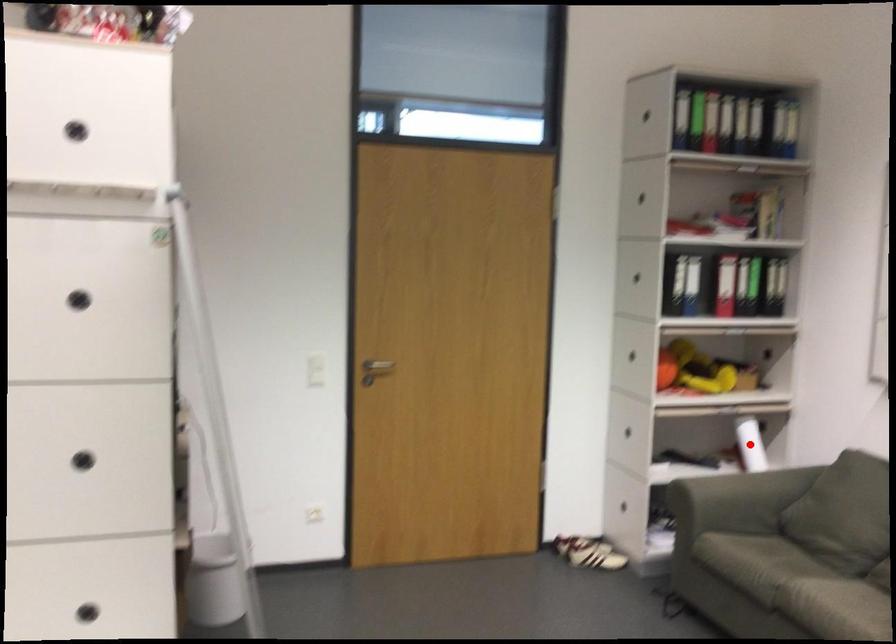
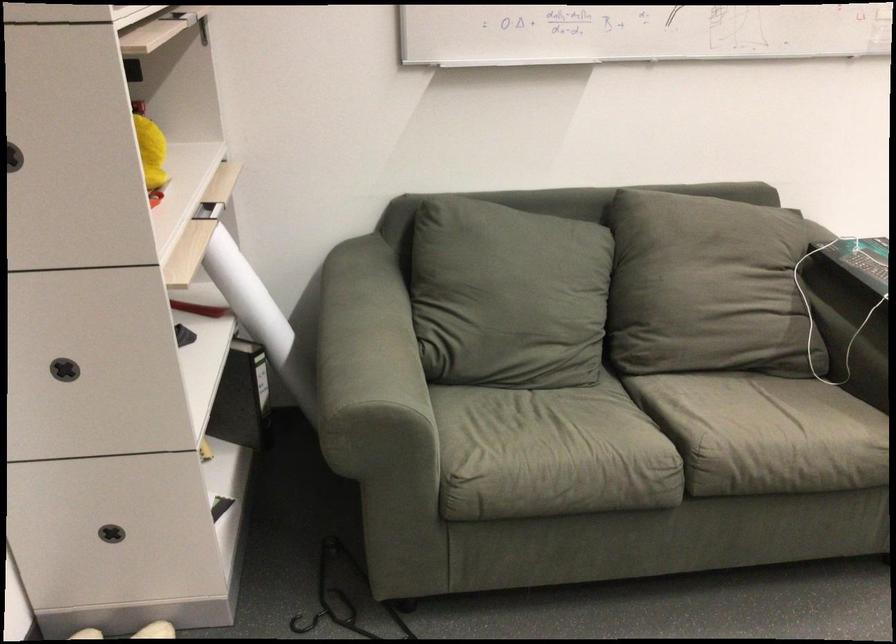
Question: I am providing you with two images of the same scene from different viewpoints. A red point is marked on the first image. Is the red point's position out of view in image 2?

Choices:
 (A) Yes
 (B) No

Answer: (A)